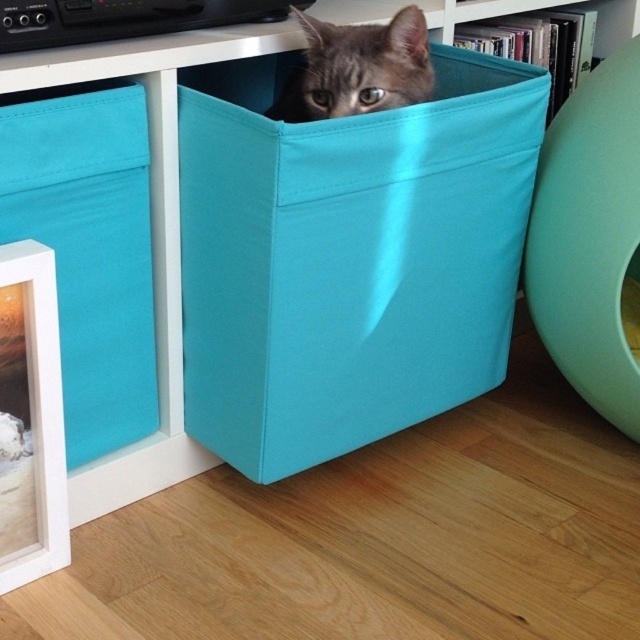
Looking at this image, you are organizing a playroom and need to arrange two teal fabric boxes. The scene shows a teal fabric box at center and a teal fabric box at left. Which box is positioned further to the left side of the room?

The teal fabric box at left is positioned further to the left side of the room compared to the teal fabric box at center.

You are standing in the room and want to move from point (285, 467) to point (378, 40). Which direction should you face to walk towards the second point?

Since point (285, 467) is closer to you than point (378, 40), you should face towards the left side of the room to walk towards point (378, 40).